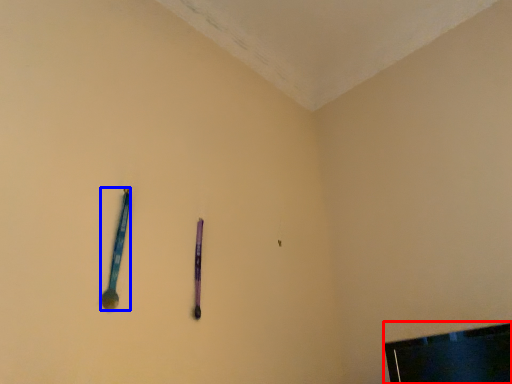
Question: Among these objects, which one is farthest to the camera, television (highlighted by a red box) or spoon (highlighted by a blue box)?

Choices:
 (A) television
 (B) spoon

Answer: (B)